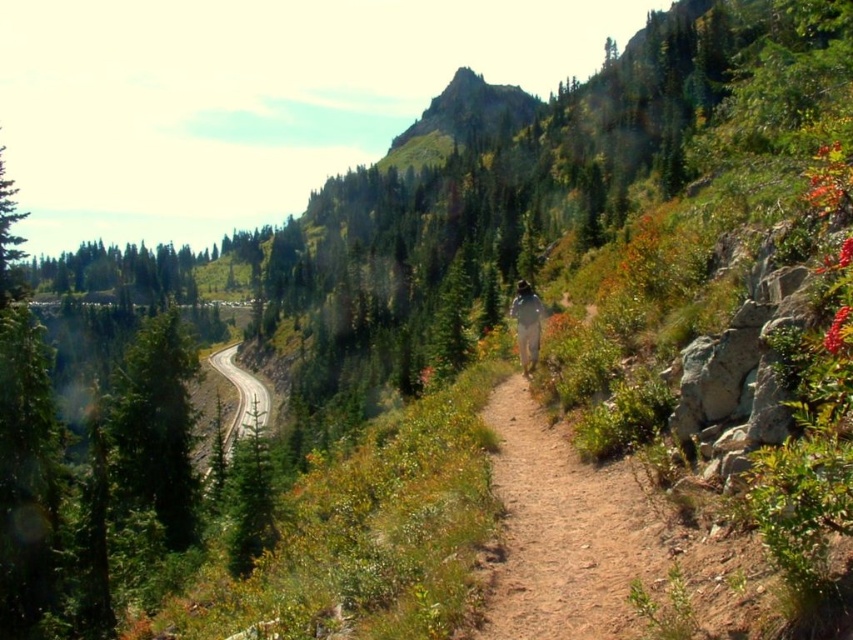
Question: Can you confirm if smooth asphalt road at left is thinner than white fabric at center?

Choices:
 (A) no
 (B) yes

Answer: (A)

Question: Does smooth asphalt road at left have a lesser width compared to white fabric at center?

Choices:
 (A) yes
 (B) no

Answer: (B)

Question: Among these objects, which one is farthest from the camera?

Choices:
 (A) white fabric at center
 (B) smooth asphalt road at left

Answer: (B)

Question: Which object appears farthest from the camera in this image?

Choices:
 (A) white fabric at center
 (B) smooth asphalt road at left

Answer: (B)

Question: Is smooth asphalt road at left wider than white fabric at center?

Choices:
 (A) yes
 (B) no

Answer: (A)